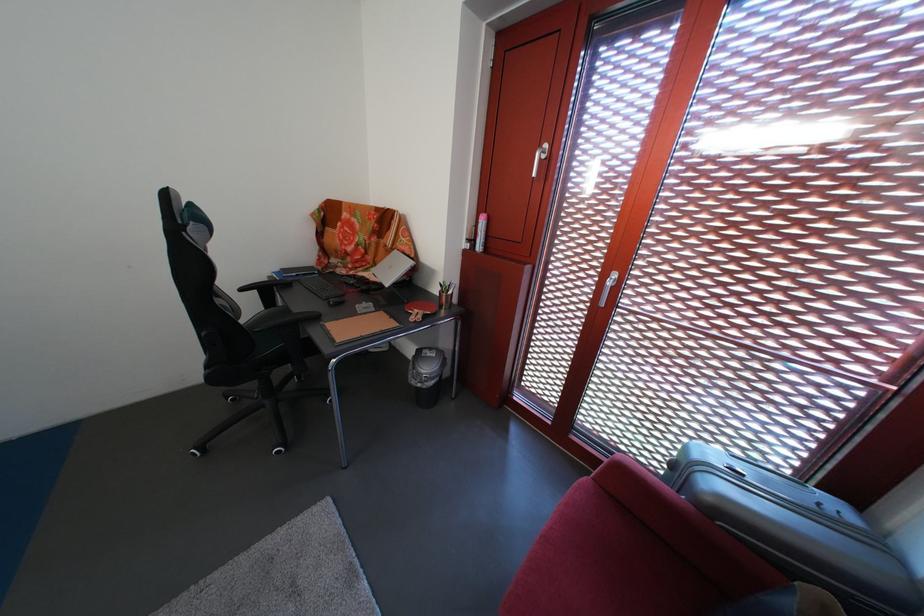
You are a GUI agent. You are given a task and a screenshot of the screen. Output one action in this format:
    pyautogui.click(x=<x>, y=<y>)
    Task: Click on the black chair armrest
    
    Given the screenshot: What is the action you would take?
    pyautogui.click(x=280, y=342)